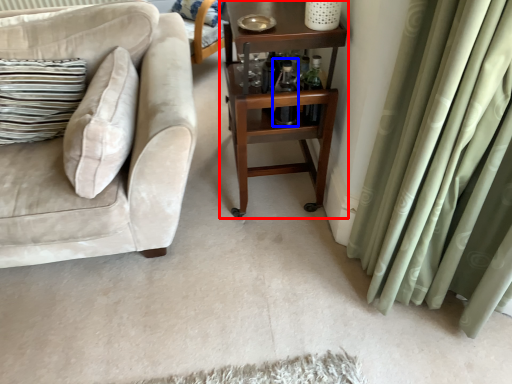
Question: Among these objects, which one is nearest to the camera, table (highlighted by a red box) or bottle (highlighted by a blue box)?

Choices:
 (A) table
 (B) bottle

Answer: (A)